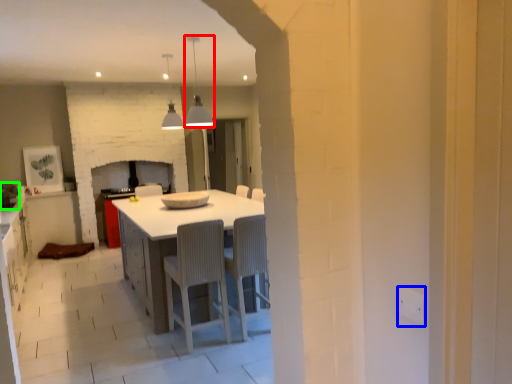
Question: Which is nearer to the light fixture (highlighted by a red box)? electric outlet (highlighted by a blue box) or appliance (highlighted by a green box).

Choices:
 (A) electric outlet
 (B) appliance

Answer: (B)